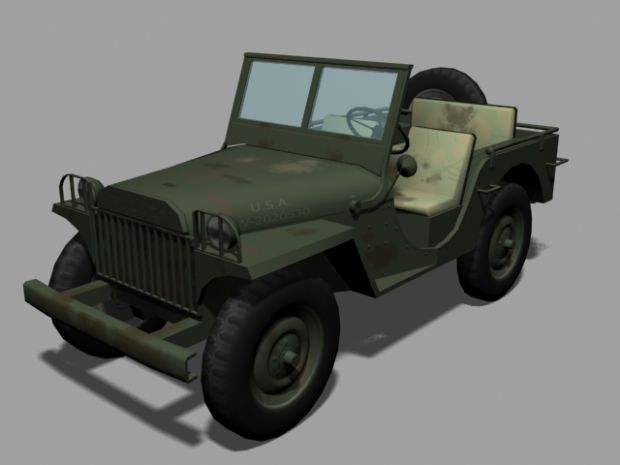
Where is `hood`? The height and width of the screenshot is (465, 620). hood is located at coordinates (248, 177).